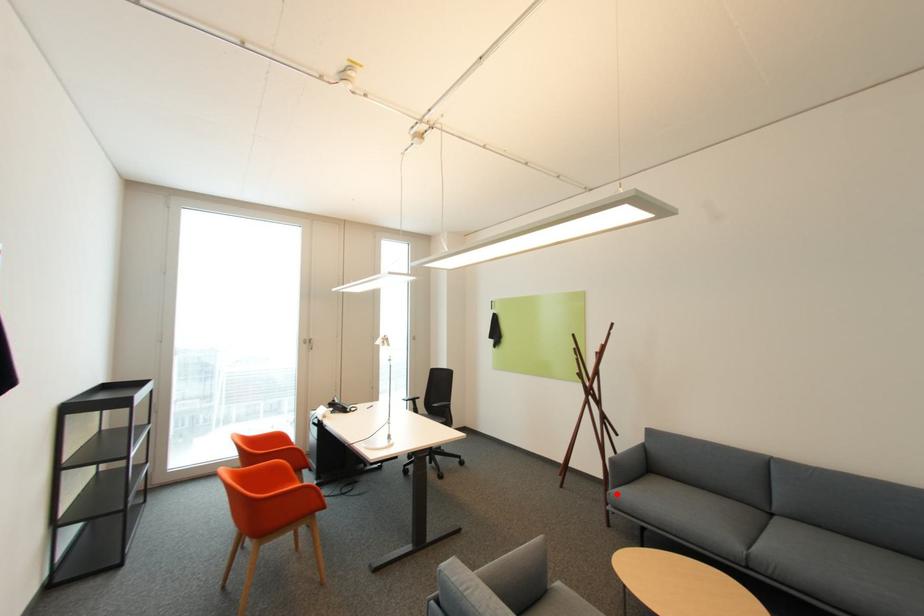
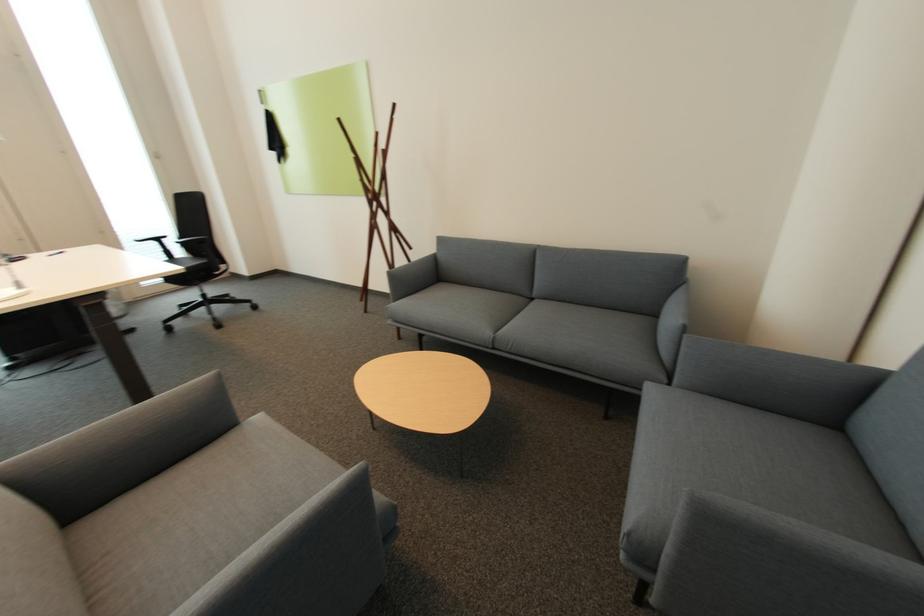
The point at the highlighted location is marked in the first image. Where is the corresponding point in the second image?

(394, 308)